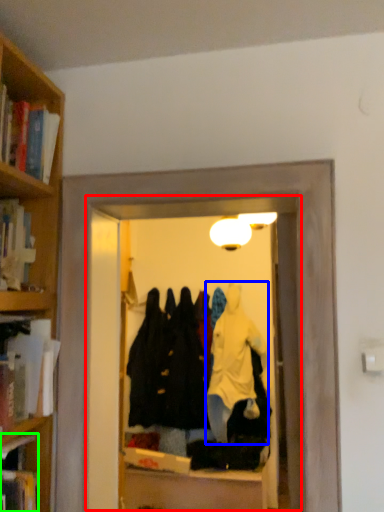
Question: Which object is positioned closest to glass door (highlighted by a red box)? Select from bathrobe (highlighted by a blue box) and book (highlighted by a green box).

Choices:
 (A) bathrobe
 (B) book

Answer: (A)